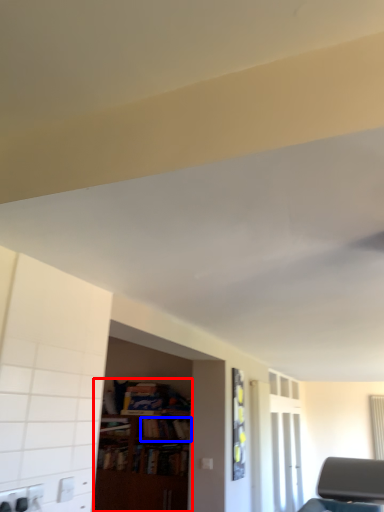
Question: Among these objects, which one is nearest to the camera, bookcase (highlighted by a red box) or book (highlighted by a blue box)?

Choices:
 (A) bookcase
 (B) book

Answer: (A)